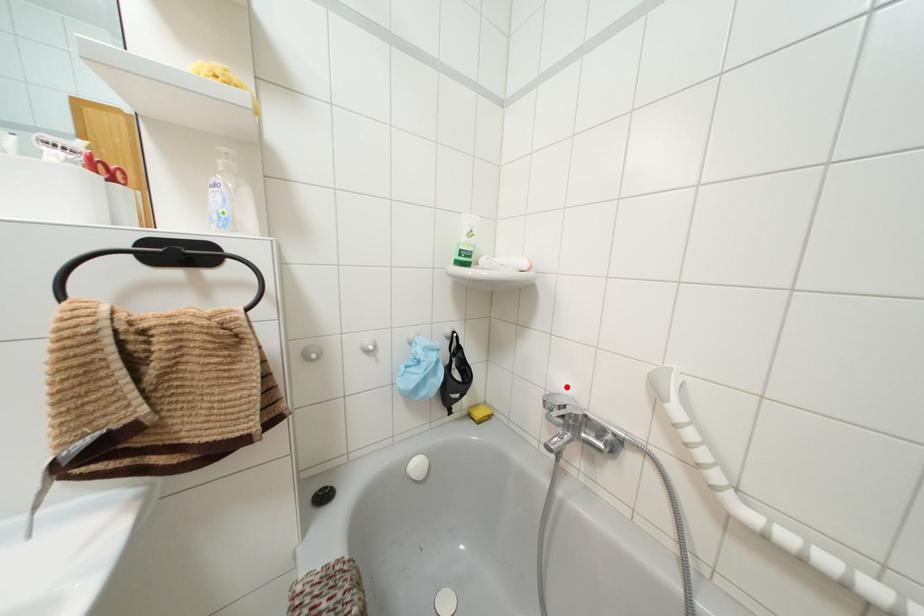
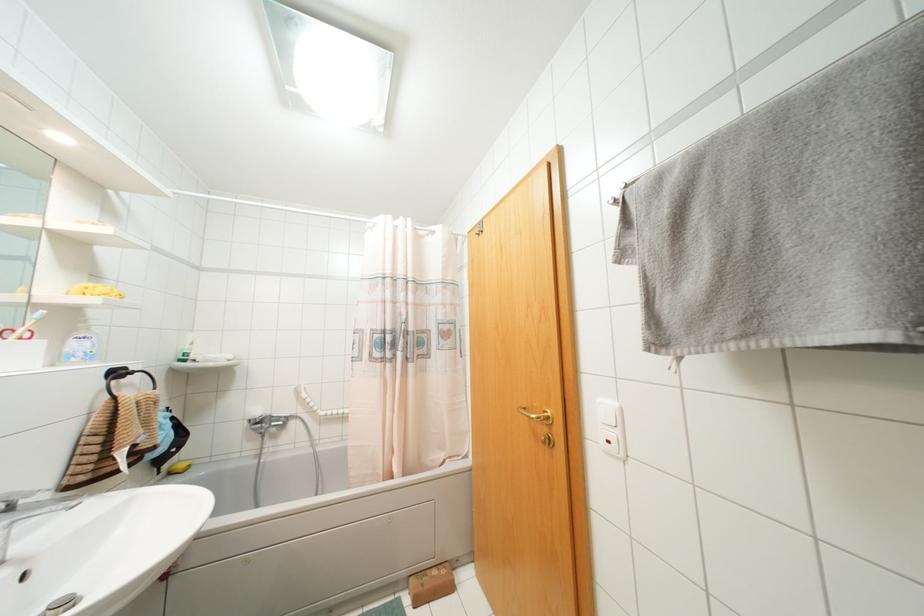
Question: I am providing you with two images of the same scene from different viewpoints. A red point is marked on the first image. Is the red point's position out of view in image 2?

Choices:
 (A) Yes
 (B) No

Answer: (B)